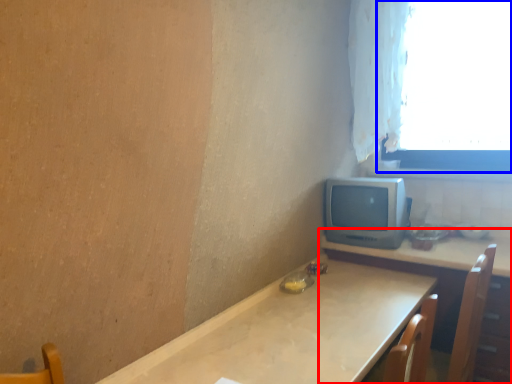
Question: Which of the following is the farthest to the observer, table (highlighted by a red box) or window (highlighted by a blue box)?

Choices:
 (A) table
 (B) window

Answer: (B)